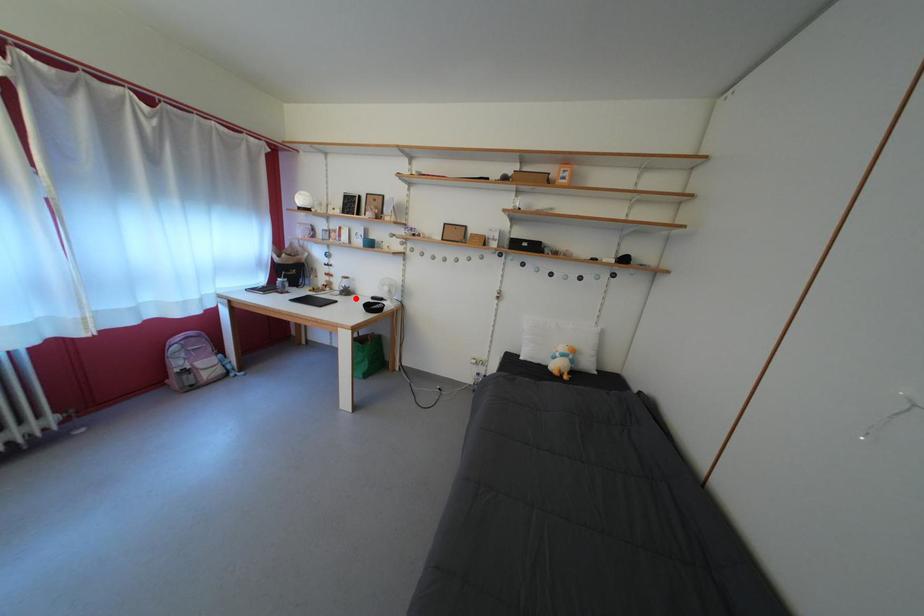
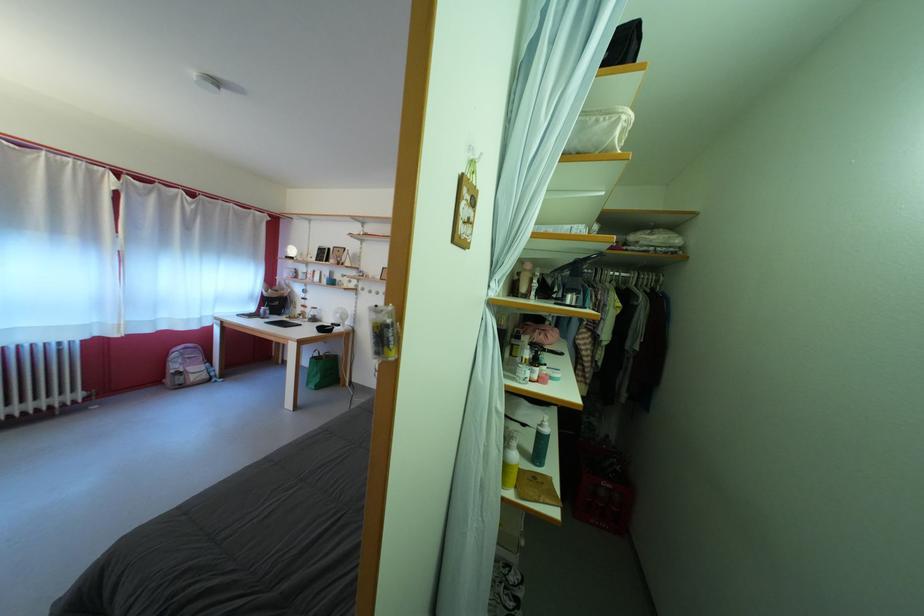
In the second image, find the point that corresponds to the highlighted location in the first image.

(322, 325)